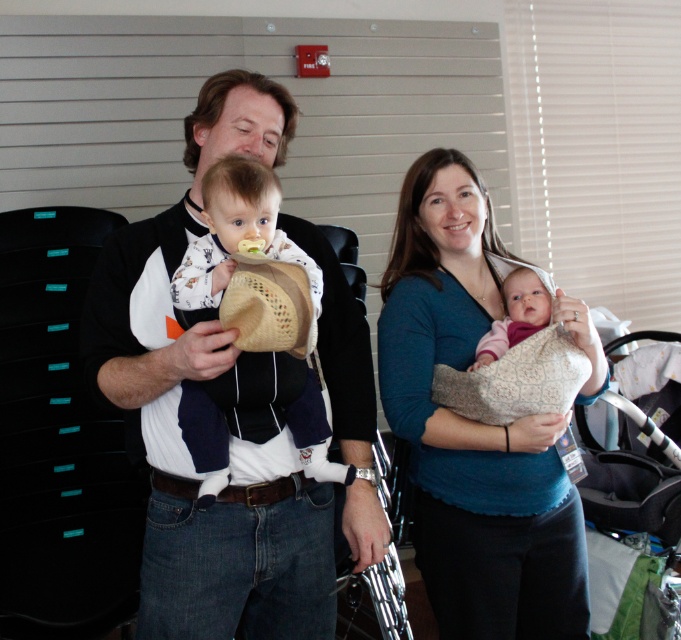
Question: Which point is farther to the camera?

Choices:
 (A) blue soft fabric baby carrier at center
 (B) white cotton shirt at center

Answer: (A)

Question: Considering the real-world distances, which object is closest to the white cotton baby at center?

Choices:
 (A) blue soft fabric baby carrier at center
 (B) white cotton shirt at center
 (C) pink soft fabric baby at center

Answer: (B)

Question: Can you confirm if white cotton shirt at center is positioned above pink soft fabric baby at center?

Choices:
 (A) yes
 (B) no

Answer: (B)

Question: Is blue soft fabric baby carrier at center wider than white cotton baby at center?

Choices:
 (A) no
 (B) yes

Answer: (B)

Question: Which of the following is the closest to the observer?

Choices:
 (A) white cotton baby at center
 (B) pink soft fabric baby at center
 (C) white cotton shirt at center

Answer: (A)

Question: Is white cotton shirt at center smaller than white cotton baby at center?

Choices:
 (A) no
 (B) yes

Answer: (A)